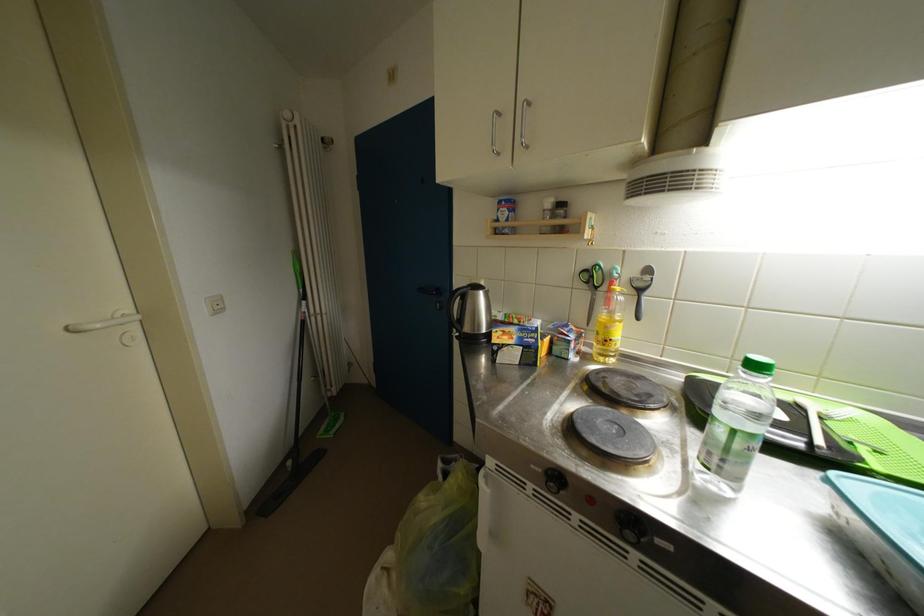
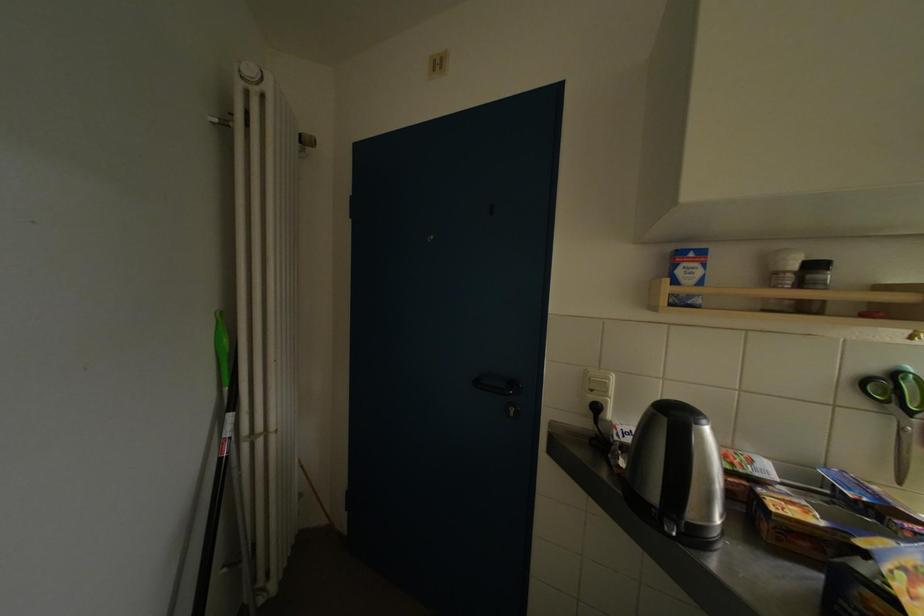
Question: The camera is either moving clockwise (left) or counter-clockwise (right) around the object. The first image is from the beginning of the video and the second image is from the end. Is the camera moving left or right when shooting the video?

Choices:
 (A) Left
 (B) Right

Answer: (A)